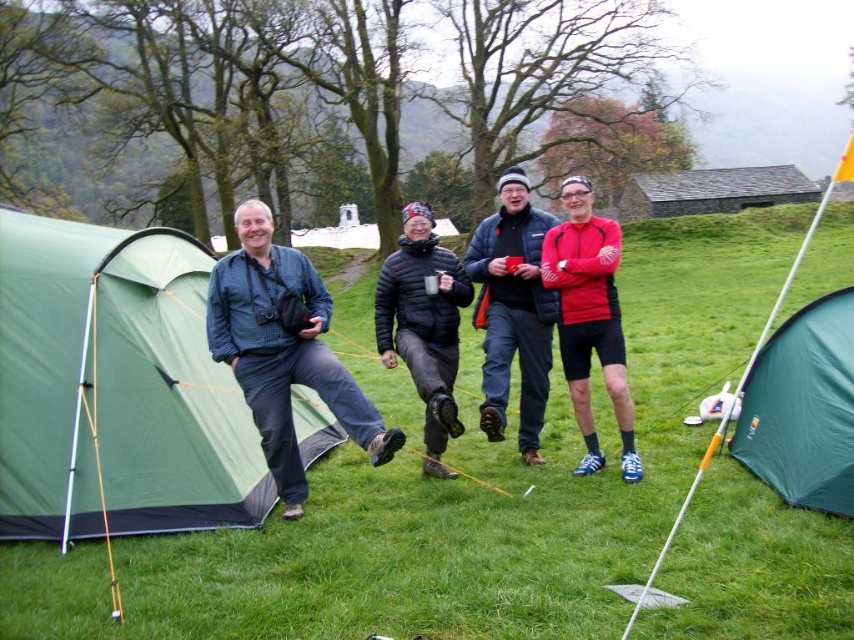
Question: Among these points, which one is farthest from the camera?

Choices:
 (A) (431, 324)
 (B) (775, 348)

Answer: (A)

Question: Does green fabric tent at lower right have a lesser width compared to matte blue jacket at center?

Choices:
 (A) yes
 (B) no

Answer: (B)

Question: Is green grass at center below black puffy jacket at center?

Choices:
 (A) yes
 (B) no

Answer: (B)

Question: Does red matte jacket at center appear on the left side of black puffy jacket at center?

Choices:
 (A) yes
 (B) no

Answer: (B)

Question: Among these objects, which one is farthest from the camera?

Choices:
 (A) green fabric tent at lower right
 (B) black puffy jacket at center

Answer: (B)

Question: Which of the following is the farthest from the observer?

Choices:
 (A) click(x=829, y=428)
 (B) click(x=202, y=349)
 (C) click(x=413, y=237)

Answer: (C)